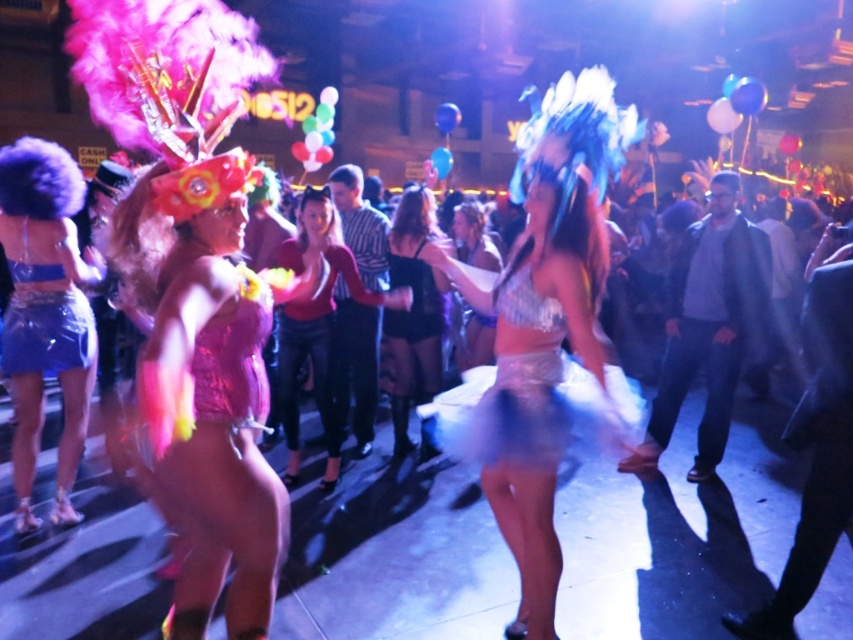
Is point (183, 609) positioned behind point (509, 387)?

No, it is in front of (509, 387).

This screenshot has height=640, width=853. What do you see at coordinates (206, 404) in the screenshot?
I see `shiny pink sequin dress at center` at bounding box center [206, 404].

Find the location of `shiny pink sequin dress at center`. shiny pink sequin dress at center is located at coordinates (206, 404).

At what (x,y) coordinates should I click in order to perform the action: click on shiny pink sequin dress at center. Please return your answer as a coordinate pair (x, y). Looking at the image, I should click on (206, 404).

Does point (310, 218) lie in front of point (422, 300)?

Yes, point (310, 218) is in front of point (422, 300).

Measure the distance from matte red blouse at center to black satin dress at center.

19.15 inches

Which is in front, point (322, 486) or point (399, 221)?

Positioned in front is point (322, 486).

The image size is (853, 640). What are the coordinates of `matte red blouse at center` in the screenshot? It's located at (318, 328).

Looking at this image, is shiny blue sequin skirt at lower left smaller than black satin dress at center?

Actually, shiny blue sequin skirt at lower left might be larger than black satin dress at center.

Find the location of a particular element. shiny blue sequin skirt at lower left is located at coordinates (45, 314).